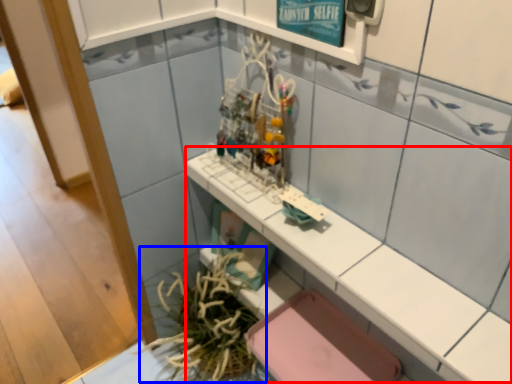
Question: Among these objects, which one is farthest to the camera, counter top (highlighted by a red box) or plant (highlighted by a blue box)?

Choices:
 (A) counter top
 (B) plant

Answer: (B)